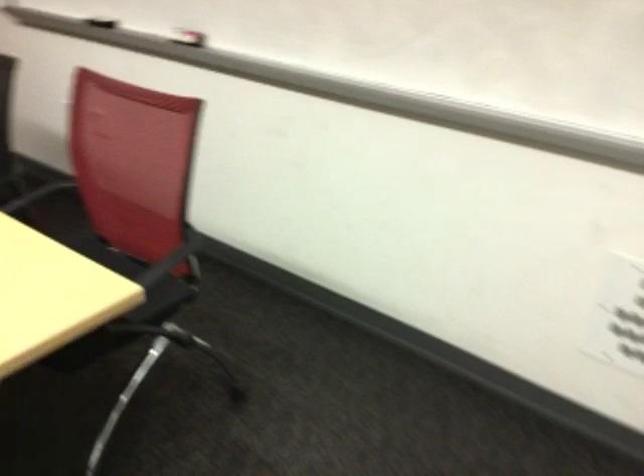
Where would you lift the red whiteboard eraser? Please return your answer as a coordinate pair (x, y).

(196, 43)